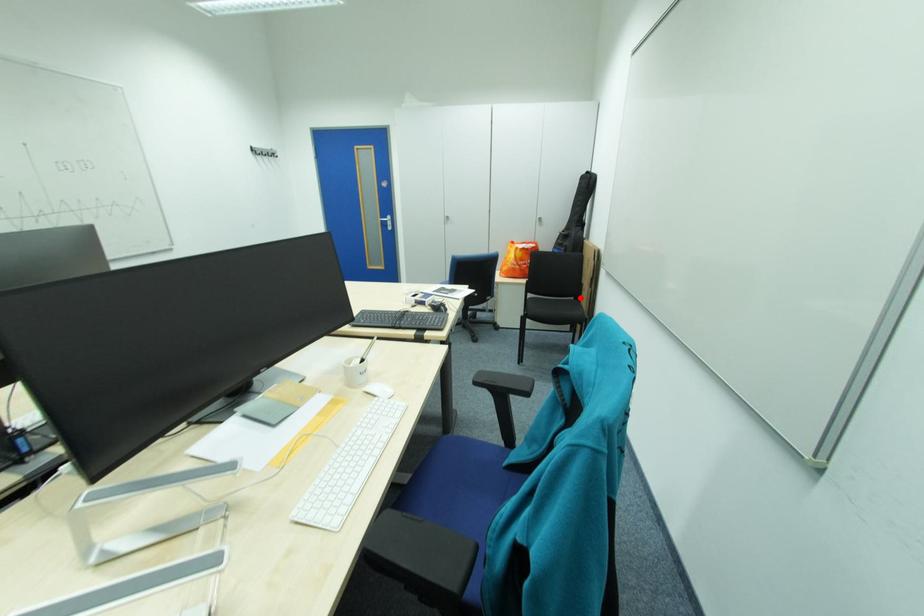
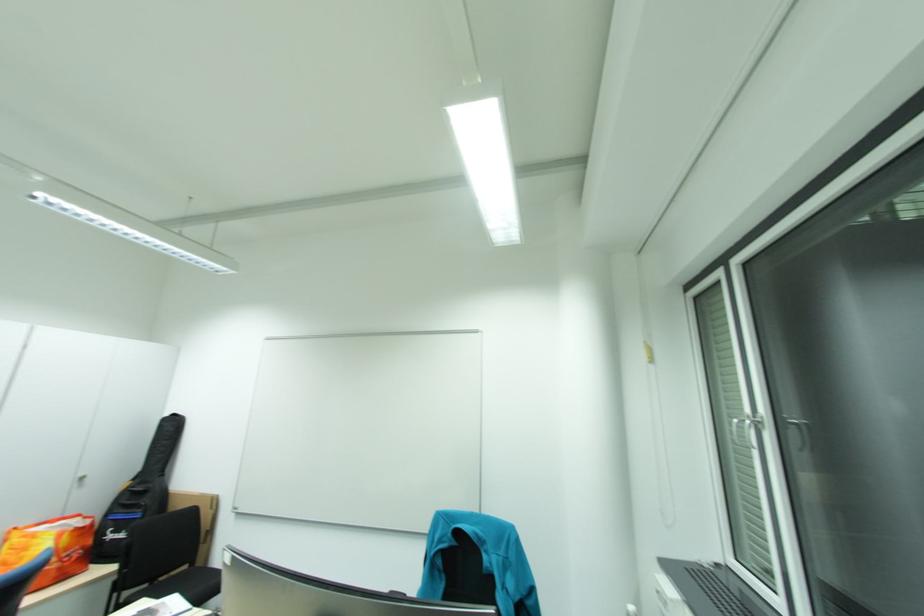
Where in the second image is the point corresponding to the highlighted location from the first image?

(193, 568)